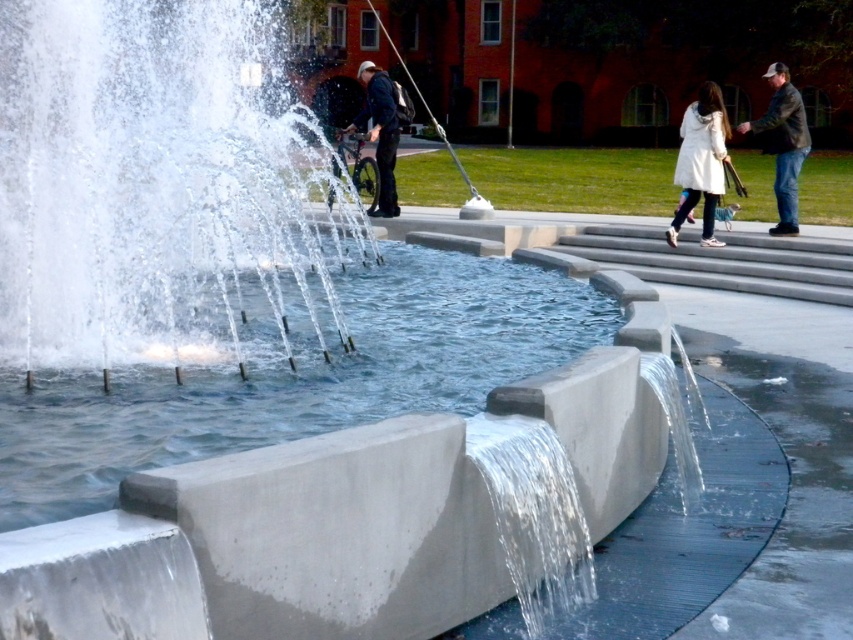
Question: Is white matte coat at upper right wider than dark blue jeans at center?

Choices:
 (A) yes
 (B) no

Answer: (B)

Question: Which is farther from the white matte coat at upper right?

Choices:
 (A) dark brown leather jacket at upper right
 (B) dark blue jeans at center
 (C) clear concrete water at center

Answer: (C)

Question: Which object is the closest to the white matte coat at upper right?

Choices:
 (A) clear concrete water at center
 (B) dark blue jeans at center
 (C) dark brown leather jacket at upper right

Answer: (C)

Question: Which of the following is the closest to the observer?

Choices:
 (A) dark brown leather jacket at upper right
 (B) dark blue jeans at center

Answer: (A)

Question: Can you confirm if white matte coat at upper right is thinner than dark brown leather jacket at upper right?

Choices:
 (A) no
 (B) yes

Answer: (B)

Question: Can you confirm if dark brown leather jacket at upper right is bigger than dark blue jeans at center?

Choices:
 (A) no
 (B) yes

Answer: (B)